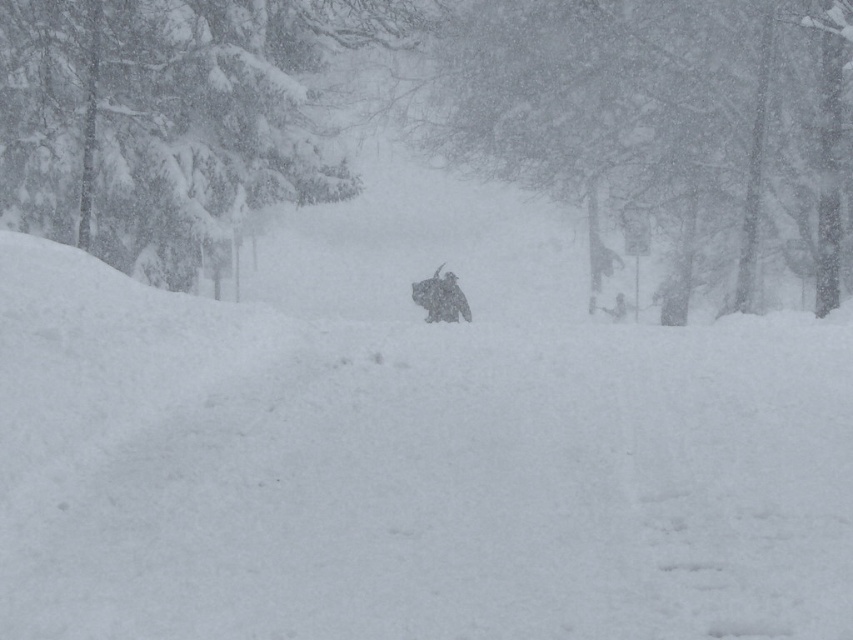
Between white fluffy hill at center and snow-covered evergreen tree at upper left, which one appears on the right side from the viewer's perspective?

From the viewer's perspective, white fluffy hill at center appears more on the right side.

Does point (200, 429) come closer to viewer compared to point (107, 252)?

That is True.

Locate an element on the screen. The image size is (853, 640). white fluffy hill at center is located at coordinates (409, 472).

Does white fluffy hill at center come behind snow-covered tree at center?

No.

What do you see at coordinates (409, 472) in the screenshot? I see `white fluffy hill at center` at bounding box center [409, 472].

Where is `white fluffy hill at center`? This screenshot has height=640, width=853. white fluffy hill at center is located at coordinates (409, 472).

This screenshot has width=853, height=640. What do you see at coordinates (412, 104) in the screenshot? I see `snow-covered tree at center` at bounding box center [412, 104].

Which is in front, point (689, 104) or point (303, 160)?

Positioned in front is point (303, 160).

Does point (105, 113) come closer to viewer compared to point (128, 216)?

Yes.

Identify the location of snow-covered tree at center. This screenshot has height=640, width=853. (412, 104).